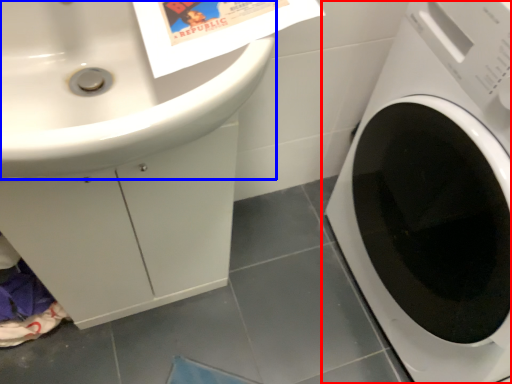
Question: Which point is closer to the camera, washing machine (highlighted by a red box) or sink (highlighted by a blue box)?

Choices:
 (A) washing machine
 (B) sink

Answer: (B)